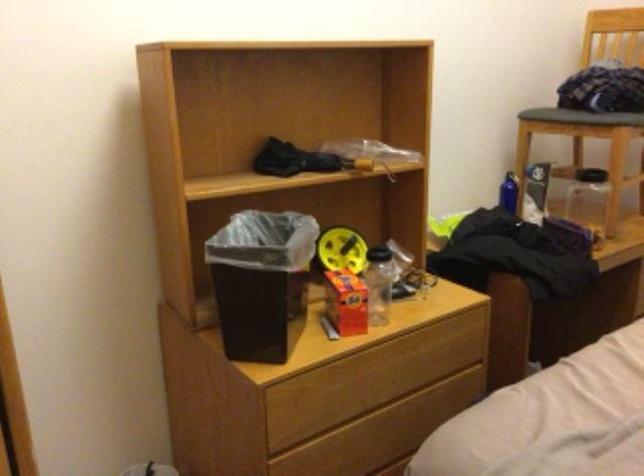
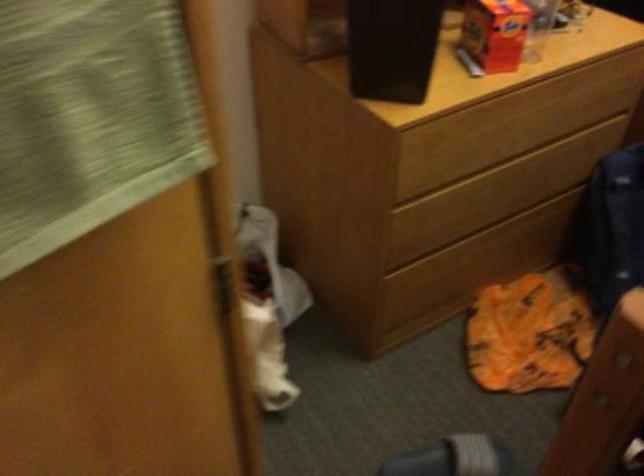
Question: The images are taken continuously from a first-person perspective. In which direction is your viewpoint rotating?

Choices:
 (A) Left
 (B) Right
 (C) Up
 (D) Down

Answer: (D)